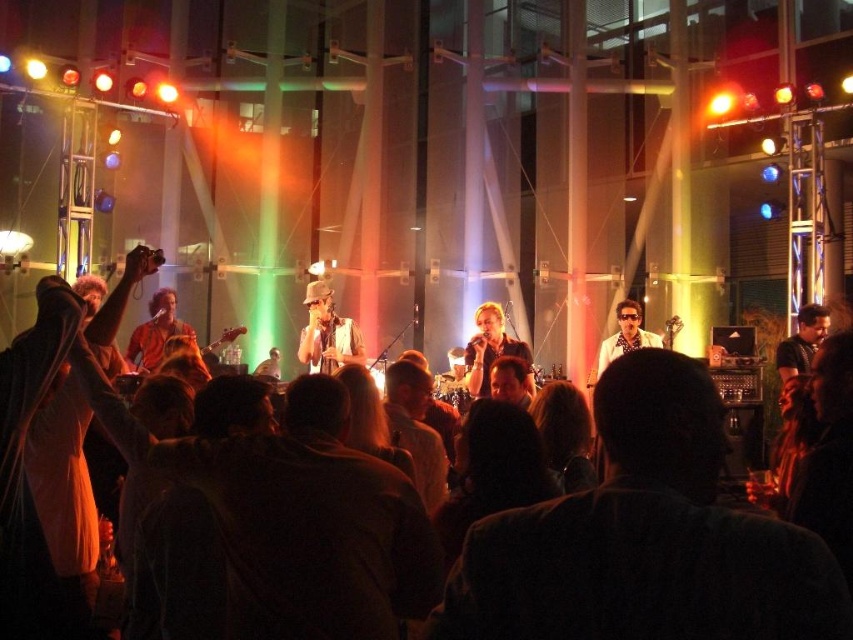
Question: Estimate the real-world distances between objects in this image. Which object is farther from the dark brown leather jacket at lower center?

Choices:
 (A) matte black microphone at center
 (B) matte gray harmonica at center

Answer: (B)

Question: In this image, where is dark brown leather jacket at lower center located relative to matte gray harmonica at center?

Choices:
 (A) below
 (B) above

Answer: (A)

Question: Which point is farther from the camera taking this photo?

Choices:
 (A) (479, 316)
 (B) (456, 637)
 (C) (622, 316)
 (D) (337, 316)

Answer: (D)

Question: Does matte black microphone at center have a larger size compared to white glossy shirt at center?

Choices:
 (A) no
 (B) yes

Answer: (B)

Question: Does dark brown leather jacket at lower center appear over matte black microphone at center?

Choices:
 (A) no
 (B) yes

Answer: (A)

Question: Which of the following is the farthest from the observer?

Choices:
 (A) matte black microphone at center
 (B) white glossy shirt at center

Answer: (B)